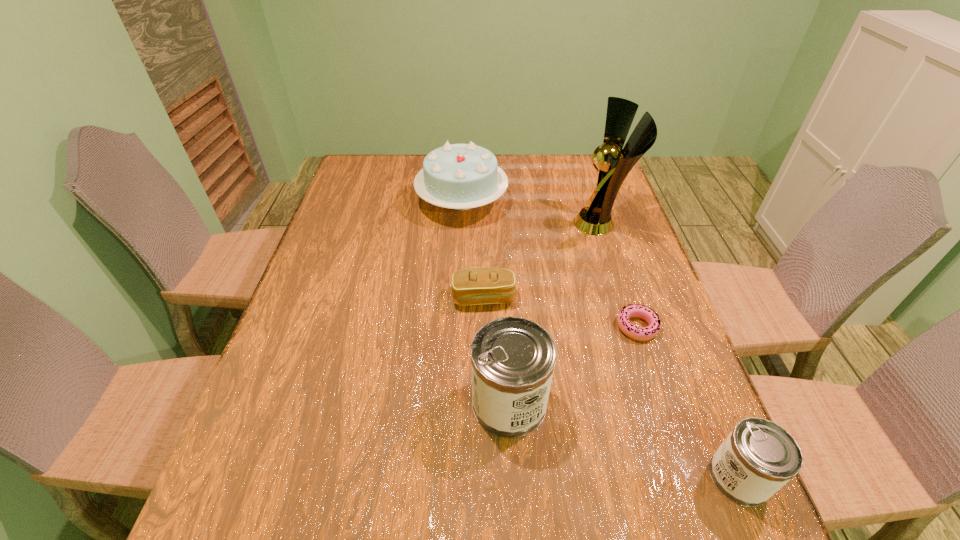
I want to click on free point that keeps the cans evenly spaced on the left, so coord(328,344).